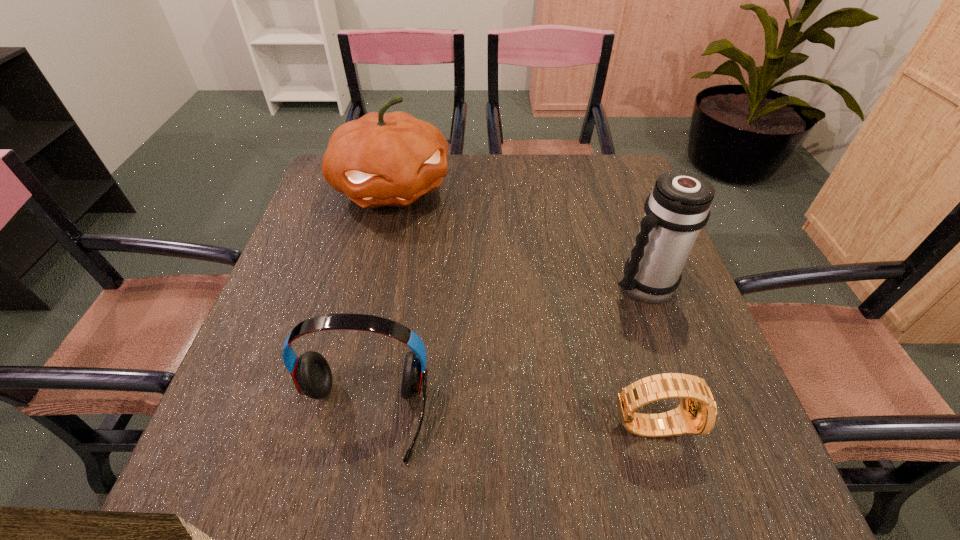
You are a GUI agent. You are given a task and a screenshot of the screen. Output one action in this format:
    pyautogui.click(x=<x>, y=<y>)
    Task: Click on the object that is positioned at the near right corner
    
    Given the screenshot: What is the action you would take?
    pyautogui.click(x=697, y=413)

This screenshot has height=540, width=960. Identify the location of free space at the far edge of the desktop. (527, 160).

Identify the location of vacant space at the near edge of the desktop. The image size is (960, 540). (339, 417).

The image size is (960, 540). I want to click on free space at the left edge, so click(x=315, y=202).

Identify the location of vacant space at the far right corner of the desktop. (631, 188).

Locate an element on the screen. This screenshot has height=540, width=960. empty space that is in between the shortest object and the second shortest object is located at coordinates pyautogui.click(x=507, y=420).

The width and height of the screenshot is (960, 540). I want to click on blank region between the third nearest object and the watch, so click(647, 355).

Where is `vacant point located between the pumpkin and the headset`? vacant point located between the pumpkin and the headset is located at coordinates (377, 302).

Where is `empty space between the pumpkin and the thermos bottle`? This screenshot has width=960, height=540. empty space between the pumpkin and the thermos bottle is located at coordinates (517, 237).

Locate an element on the screen. The width and height of the screenshot is (960, 540). vacant space that's between the farthest object and the shortest object is located at coordinates (521, 307).